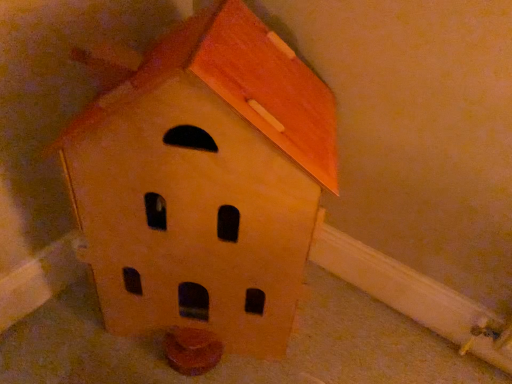
Describe the element at coordinates (203, 181) in the screenshot. The image size is (512, 384). I see `matte wood house at center` at that location.

The width and height of the screenshot is (512, 384). Identify the location of matte wood house at center. (203, 181).

Measure the distance between matte wood house at center and camera.

The depth of matte wood house at center is 63.74 centimeters.

This screenshot has height=384, width=512. I want to click on matte wood house at center, so click(203, 181).